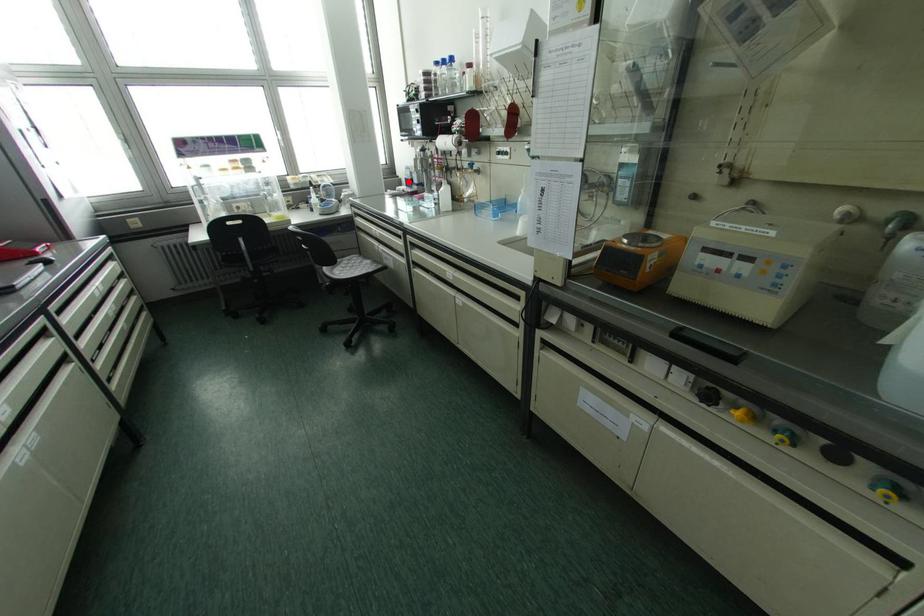
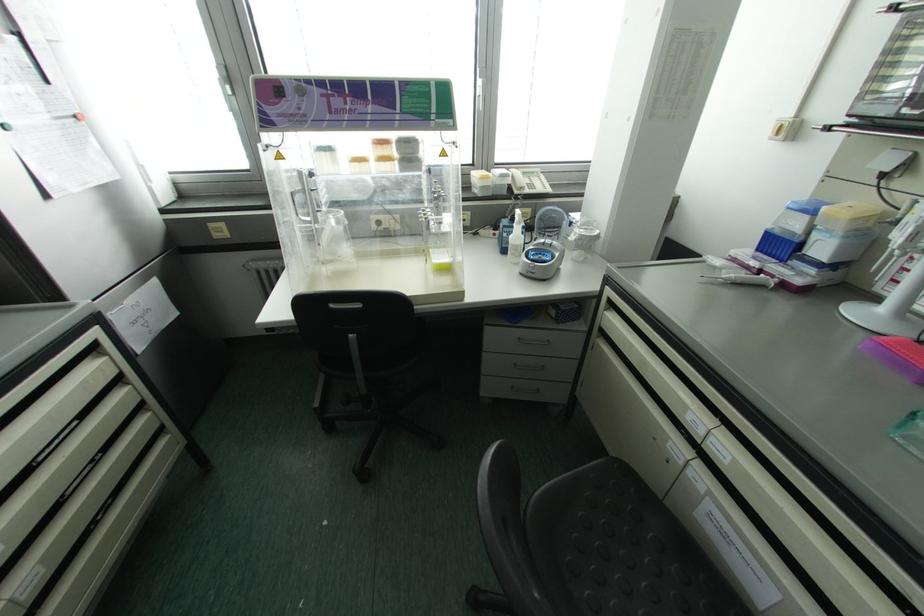
In the second image, find the point that corresponds to the highlighted location in the first image.

(777, 245)